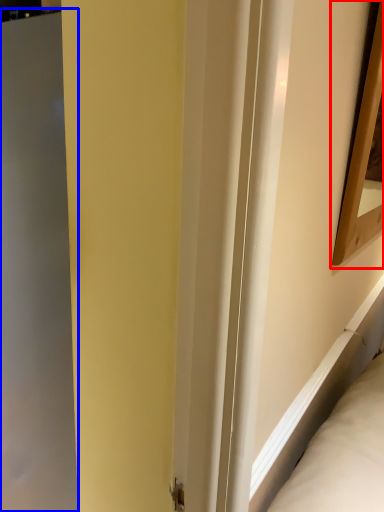
Question: Among these objects, which one is nearest to the camera, picture frame (highlighted by a red box) or screen door (highlighted by a blue box)?

Choices:
 (A) picture frame
 (B) screen door

Answer: (A)